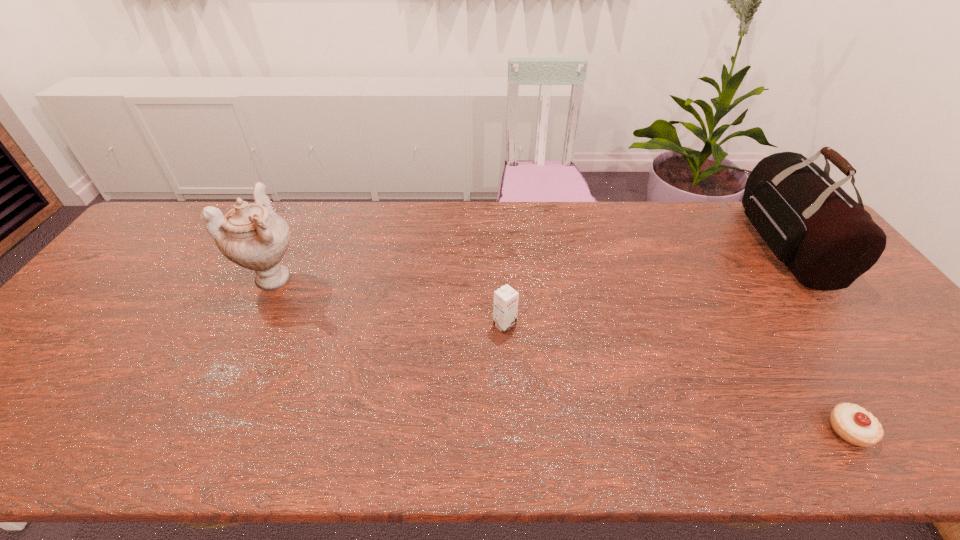
In order to click on empty space that is in between the shortest object and the duffel bag in this screenshot , I will do `click(817, 337)`.

At what (x,y) coordinates should I click in order to perform the action: click on vacant point located between the leftmost object and the third object from right to left. Please return your answer as a coordinate pair (x, y). The image size is (960, 540). Looking at the image, I should click on (390, 301).

The height and width of the screenshot is (540, 960). I want to click on free space between the pastry and the duffel bag, so click(817, 337).

Identify the location of vacant space in between the third object from left to right and the third farthest object. (677, 377).

In order to click on empty space that is in between the third farthest object and the urn in this screenshot , I will do `click(390, 301)`.

Image resolution: width=960 pixels, height=540 pixels. I want to click on vacant area between the third object from right to left and the leftmost object, so click(390, 301).

What are the coordinates of `free space between the third object from left to right and the duffel bag` in the screenshot? It's located at (817, 337).

This screenshot has height=540, width=960. Find the location of `unoccupied area between the urn and the nearest object`. unoccupied area between the urn and the nearest object is located at coordinates (562, 354).

Locate an element on the screen. This screenshot has height=540, width=960. free space between the second object from right to left and the rightmost object is located at coordinates (817, 337).

The width and height of the screenshot is (960, 540). In order to click on free area in between the third object from right to left and the nearest object in this screenshot , I will do `click(677, 377)`.